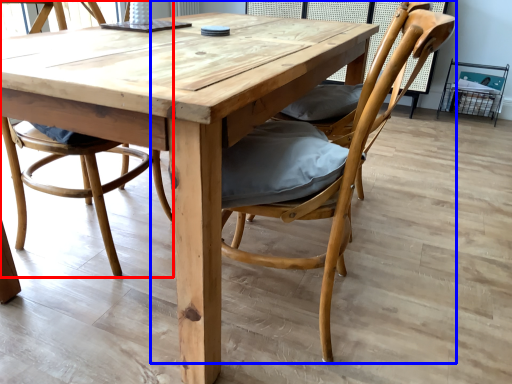
Question: Which object is closer to the camera taking this photo, chair (highlighted by a red box) or chair (highlighted by a blue box)?

Choices:
 (A) chair
 (B) chair

Answer: (B)